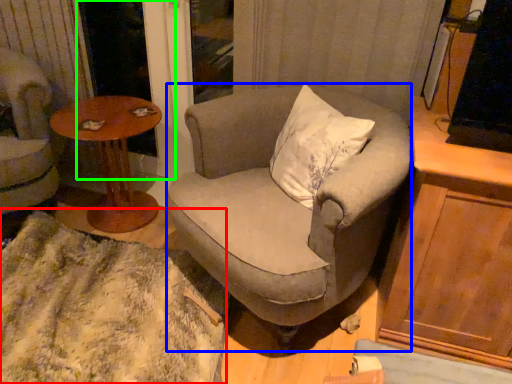
Question: Which object is the closest to the blanket (highlighted by a red box)? Choose among these: chair (highlighted by a blue box) or screen door (highlighted by a green box).

Choices:
 (A) chair
 (B) screen door

Answer: (A)